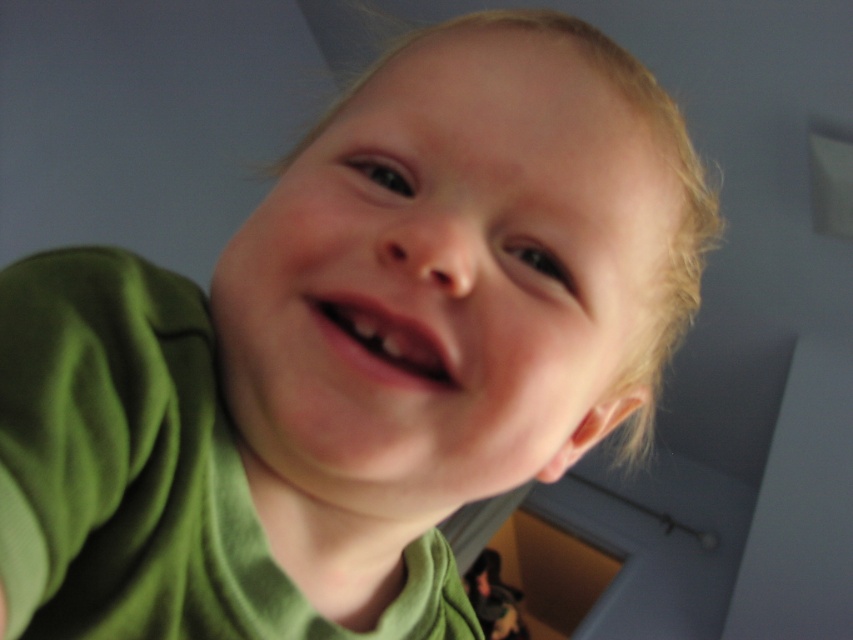
Question: Which of the following is the farthest from the observer?

Choices:
 (A) smooth skin face at center
 (B) pink matte lips at center

Answer: (B)

Question: Is smooth skin face at center bigger than pink matte lips at center?

Choices:
 (A) yes
 (B) no

Answer: (A)

Question: Which object appears farthest from the camera in this image?

Choices:
 (A) pink matte lips at center
 (B) smooth skin face at center

Answer: (A)

Question: From the image, what is the correct spatial relationship of smooth skin face at center in relation to pink matte lips at center?

Choices:
 (A) right
 (B) left

Answer: (A)

Question: Is the position of smooth skin face at center less distant than that of pink matte lips at center?

Choices:
 (A) yes
 (B) no

Answer: (A)